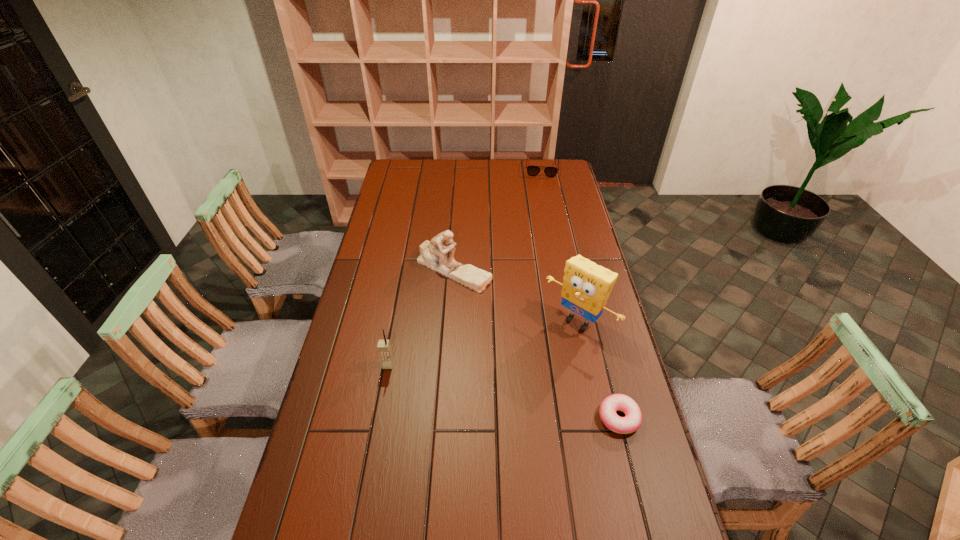
Locate an element on the screen. vacant position at the right edge of the desktop is located at coordinates (547, 210).

Locate an element on the screen. Image resolution: width=960 pixels, height=540 pixels. vacant space at the far left corner is located at coordinates (404, 173).

The image size is (960, 540). I want to click on empty location between the second nearest object and the tallest object, so point(484,343).

This screenshot has height=540, width=960. Find the location of `blank region between the fourth object from right to left and the doughnut`. blank region between the fourth object from right to left and the doughnut is located at coordinates (536, 343).

This screenshot has width=960, height=540. Identify the location of free spot between the sponge and the second nearest object. point(484,343).

Where is `free spot between the fourth tallest object and the figurine`? free spot between the fourth tallest object and the figurine is located at coordinates (497, 219).

Where is `unoccupied area between the tallest object and the spectacles`? The width and height of the screenshot is (960, 540). unoccupied area between the tallest object and the spectacles is located at coordinates (561, 245).

Locate an element on the screen. This screenshot has height=540, width=960. vacant area that lies between the doughnut and the figurine is located at coordinates (536, 343).

This screenshot has width=960, height=540. What are the coordinates of `the second closest object to the second nearest object` in the screenshot? It's located at (587, 286).

The width and height of the screenshot is (960, 540). Identify the location of the fourth closest object to the nearest object. (531, 170).